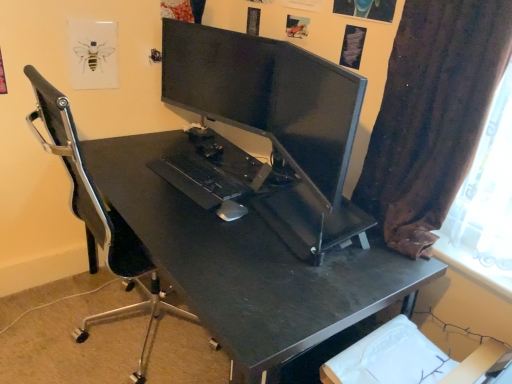
I want to click on free space on the front side of white matte mouse at center, so click(x=223, y=237).